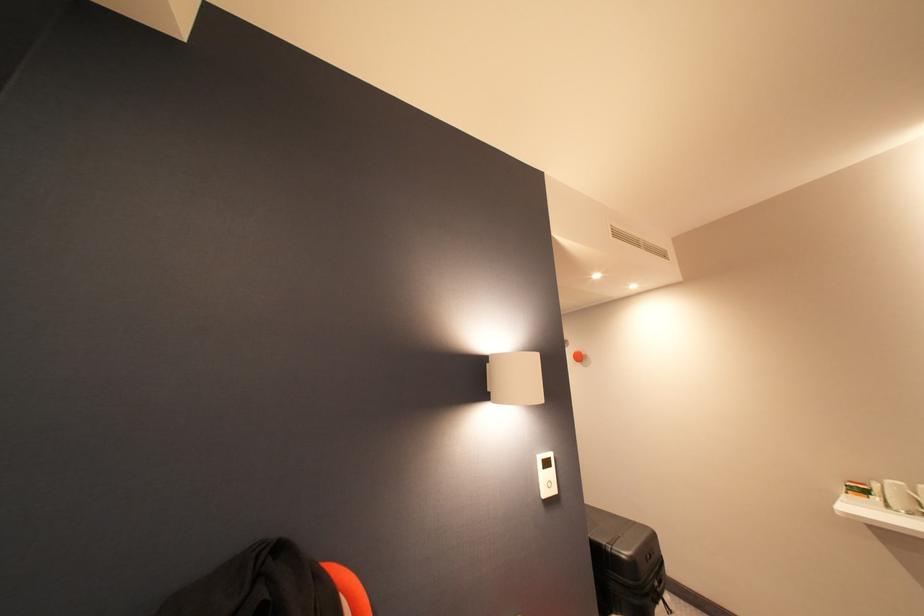
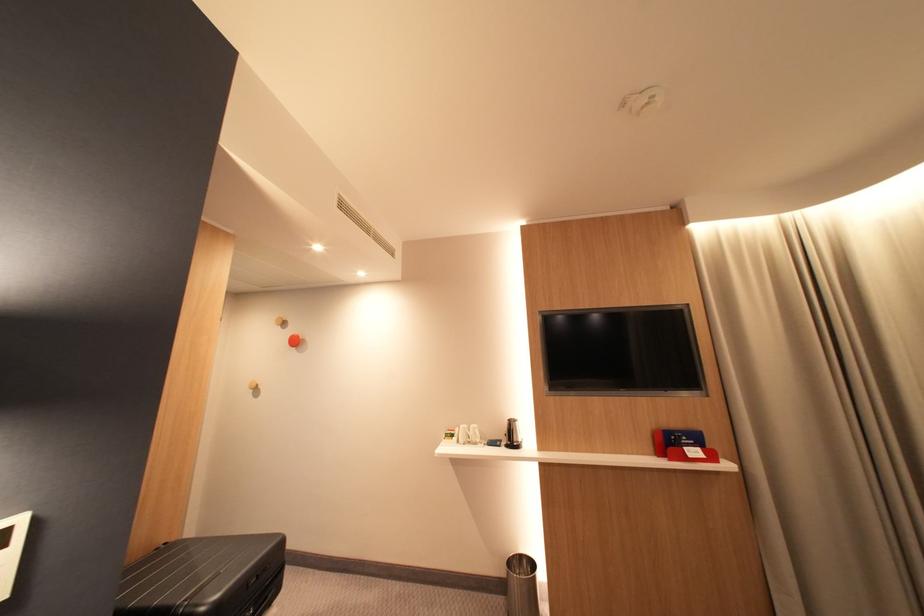
Find the pixel in the second image that matches point 660,557 in the first image.

(266, 578)